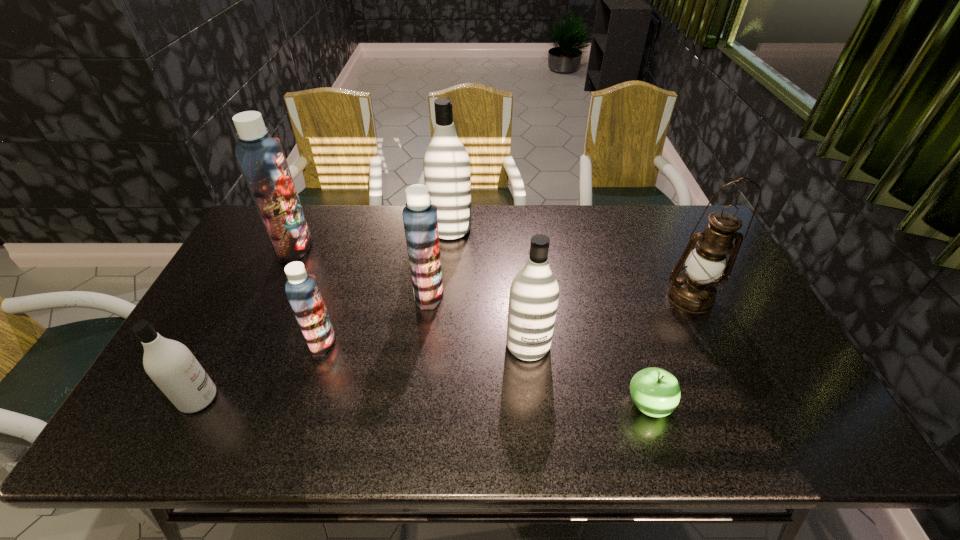
Find the location of a particular element. This screenshot has height=540, width=960. free region located on the front-facing side of the second biggest white shampoo is located at coordinates (532, 381).

This screenshot has width=960, height=540. What are the coordinates of `blank area located on the front label of the sixth object from right to left` in the screenshot? It's located at (357, 342).

Locate an element on the screen. The width and height of the screenshot is (960, 540). free space located 0.290m on the front-facing side of the smallest white shampoo is located at coordinates (338, 399).

Identify the location of free space located on the front of the apple. (661, 448).

You are a GUI agent. You are given a task and a screenshot of the screen. Output one action in this format:
    pyautogui.click(x=<x>, y=<y>)
    Task: Click on the shampoo present at the near edge
    
    Given the screenshot: What is the action you would take?
    pyautogui.click(x=170, y=364)

At what (x,y) coordinates should I click in order to perform the action: click on apple present at the near edge. Please return your answer as a coordinate pair (x, y). Image resolution: width=960 pixels, height=540 pixels. Looking at the image, I should click on coord(656,392).

This screenshot has height=540, width=960. Find the location of `object present at the right edge`. object present at the right edge is located at coordinates (695, 291).

The image size is (960, 540). I want to click on object present at the far left corner, so click(261, 158).

This screenshot has height=540, width=960. What are the coordinates of `object located at the near left corner` in the screenshot? It's located at (170, 364).

Identify the location of vacant region at the far edge. The width and height of the screenshot is (960, 540). (390, 210).